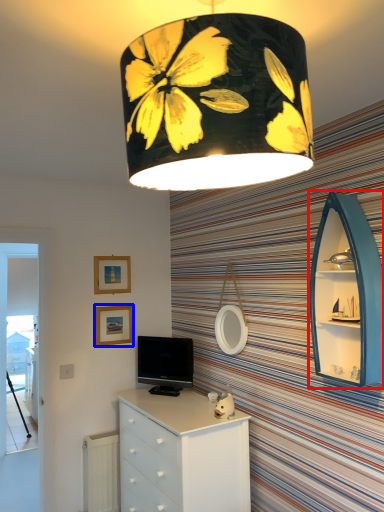
Question: Which point is closer to the camera, shelf (highlighted by a red box) or picture frame (highlighted by a blue box)?

Choices:
 (A) shelf
 (B) picture frame

Answer: (A)